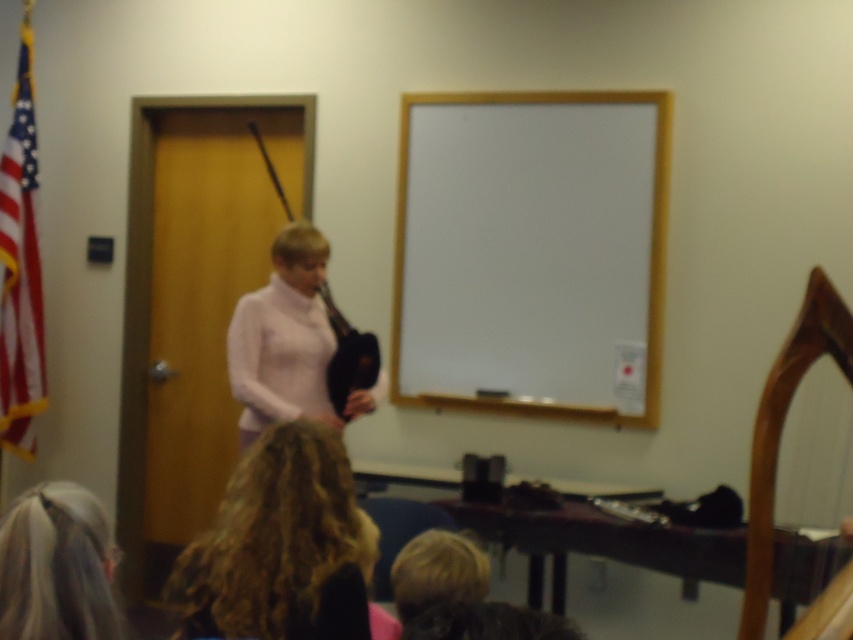
Question: Which object is farther from the camera taking this photo?

Choices:
 (A) blonde hair at lower left
 (B) blonde hair at lower center

Answer: (B)

Question: Is blonde hair at lower center in front of matte black bagpipe at center?

Choices:
 (A) no
 (B) yes

Answer: (B)

Question: Is blonde hair at lower center thinner than blonde hair at lower left?

Choices:
 (A) yes
 (B) no

Answer: (B)

Question: Which object is the closest to the matte black bagpipe at center?

Choices:
 (A) white matte board at center
 (B) blonde hair at lower left

Answer: (A)

Question: Among these objects, which one is nearest to the camera?

Choices:
 (A) white matte board at center
 (B) blonde hair at lower left

Answer: (B)

Question: Does white matte board at center appear on the right side of blonde hair at lower center?

Choices:
 (A) yes
 (B) no

Answer: (A)